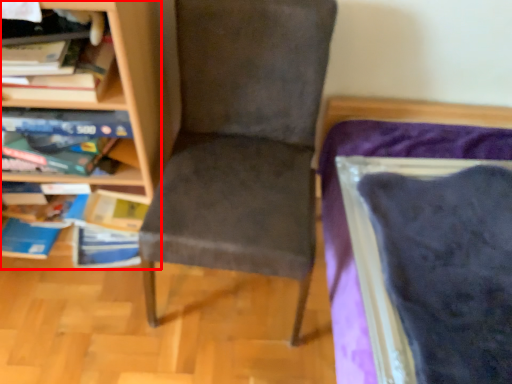
Question: From the image's perspective, where is bookcase (annotated by the red box) located relative to chair?

Choices:
 (A) below
 (B) above

Answer: (B)